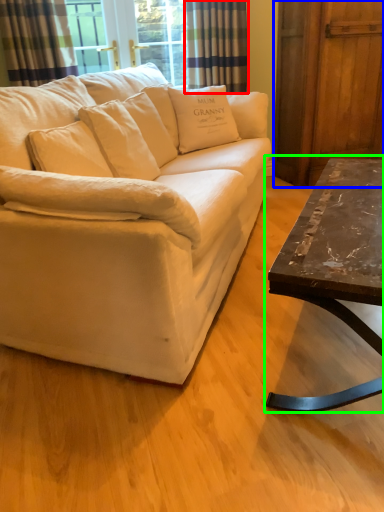
Question: Considering the real-world distances, which object is farthest from curtain (highlighted by a red box)? barn door (highlighted by a blue box) or coffee table (highlighted by a green box)?

Choices:
 (A) barn door
 (B) coffee table

Answer: (B)